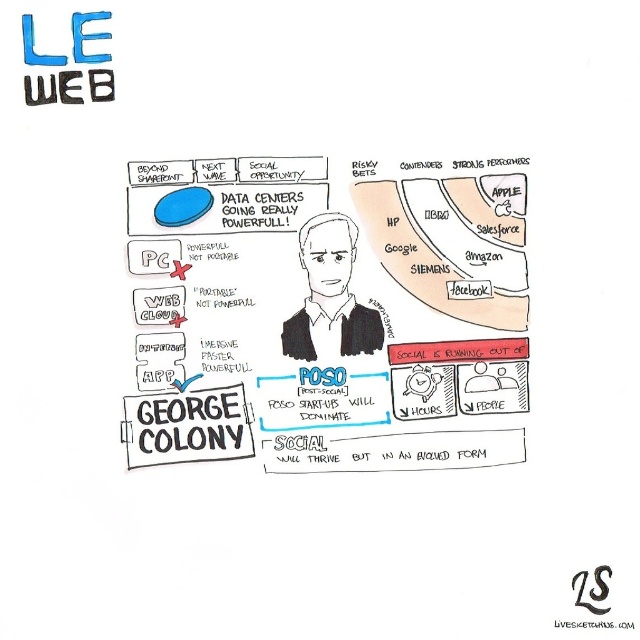
Question: Does matte black text at center appear over black matte portrait at center?

Choices:
 (A) no
 (B) yes

Answer: (A)

Question: Which point is closer to the camera taking this photo?

Choices:
 (A) (372, 310)
 (B) (348, 362)

Answer: (A)

Question: Can you confirm if matte black text at center is bigger than black matte portrait at center?

Choices:
 (A) yes
 (B) no

Answer: (A)

Question: Among these points, which one is nearest to the camera?

Choices:
 (A) (468, 401)
 (B) (308, 282)

Answer: (A)

Question: Which of the following is the closest to the observer?

Choices:
 (A) matte black text at center
 (B) black matte portrait at center

Answer: (A)

Question: Does matte black text at center appear under black matte portrait at center?

Choices:
 (A) no
 (B) yes

Answer: (B)